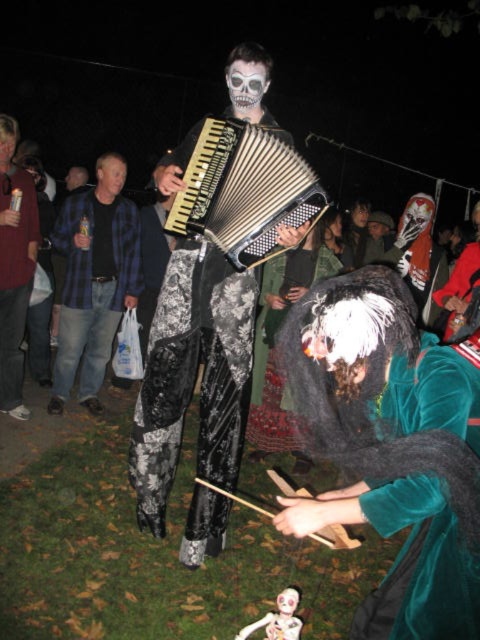
Question: Which point appears closest to the camera in this image?

Choices:
 (A) (109, 204)
 (B) (2, 212)
 (C) (227, 192)

Answer: (C)

Question: Does white painted skull at center appear on the left side of white matte skull at center?

Choices:
 (A) yes
 (B) no

Answer: (A)

Question: Which of the following is the closest to the observer?

Choices:
 (A) white matte skull at center
 (B) smooth white mask at center
 (C) smooth skin face at center

Answer: (A)

Question: Considering the relative positions of smooth skin face at upper left and smooth skin face at center in the image provided, where is smooth skin face at upper left located with respect to smooth skin face at center?

Choices:
 (A) right
 (B) left

Answer: (B)

Question: Which point is closer to the camera?

Choices:
 (A) (2, 145)
 (B) (69, 259)
 (C) (286, 598)

Answer: (C)

Question: Is black lace pants at center above brushed metal can at left?

Choices:
 (A) yes
 (B) no

Answer: (B)